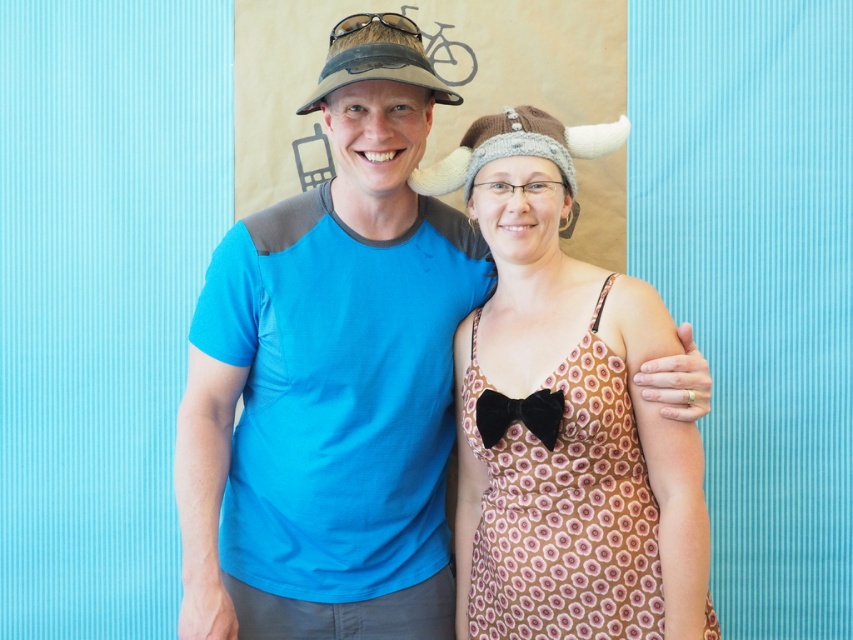
Question: Which point is closer to the camera?

Choices:
 (A) (326, 74)
 (B) (532, 116)
 (C) (531, 412)

Answer: (C)

Question: Can you confirm if blue cotton t-shirt at left is bigger than knitted woolen hat at center?

Choices:
 (A) yes
 (B) no

Answer: (A)

Question: Which of the following is the farthest from the observer?

Choices:
 (A) velvet black bow tie at center
 (B) knitted woolen hat at center
 (C) blue cotton t-shirt at left
 (D) brown textured dress at center

Answer: (B)

Question: Does blue cotton t-shirt at left have a greater width compared to brown textured dress at center?

Choices:
 (A) yes
 (B) no

Answer: (A)

Question: Can you confirm if brown fabric hat at upper center is positioned below velvet black bow tie at center?

Choices:
 (A) yes
 (B) no

Answer: (B)

Question: Among these points, which one is farthest from the camera?

Choices:
 (A) (558, 396)
 (B) (439, 80)
 (C) (241, 508)

Answer: (B)